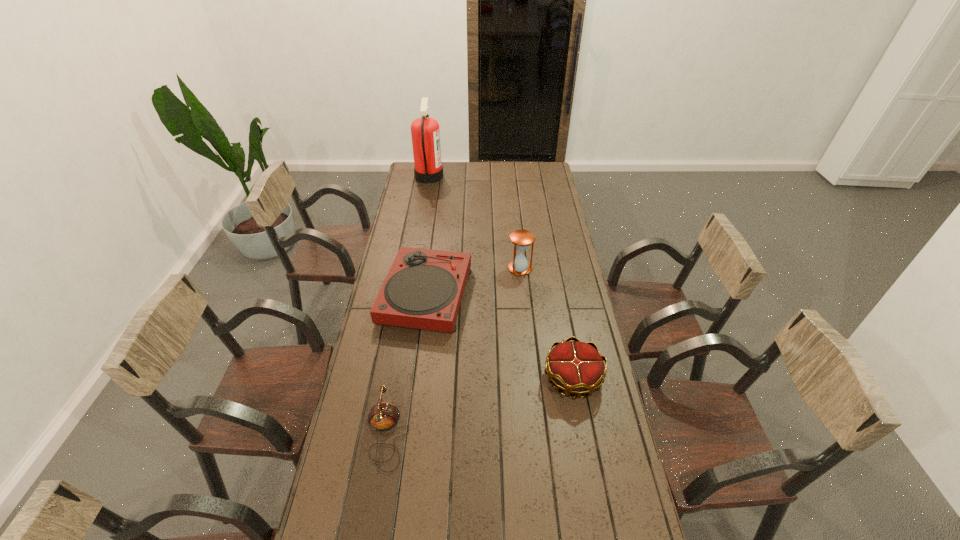
Identify the location of fire extinguisher. This screenshot has height=540, width=960. (425, 132).

Locate an element on the screen. This screenshot has width=960, height=540. the tallest object is located at coordinates (425, 132).

Locate an element on the screen. The image size is (960, 540). the fourth shortest object is located at coordinates (521, 239).

The image size is (960, 540). I want to click on record player, so click(x=423, y=289).

Find the location of a particular element. This screenshot has width=960, height=540. crown is located at coordinates (576, 367).

The image size is (960, 540). What are the coordinates of `telephone` in the screenshot? It's located at (384, 416).

Where is `free space located at the nozzle of the fire extinguisher`? The image size is (960, 540). free space located at the nozzle of the fire extinguisher is located at coordinates (510, 176).

I want to click on vacant space situated 0.400m on the left of the hourglass, so click(417, 268).

This screenshot has height=540, width=960. Find the location of `vacant region located 0.330m on the front of the record player`. vacant region located 0.330m on the front of the record player is located at coordinates (410, 416).

At what (x,y) coordinates should I click in order to perform the action: click on free space located 0.050m on the back of the crown. Please return your answer as a coordinate pair (x, y). The height and width of the screenshot is (540, 960). Looking at the image, I should click on pyautogui.click(x=566, y=344).